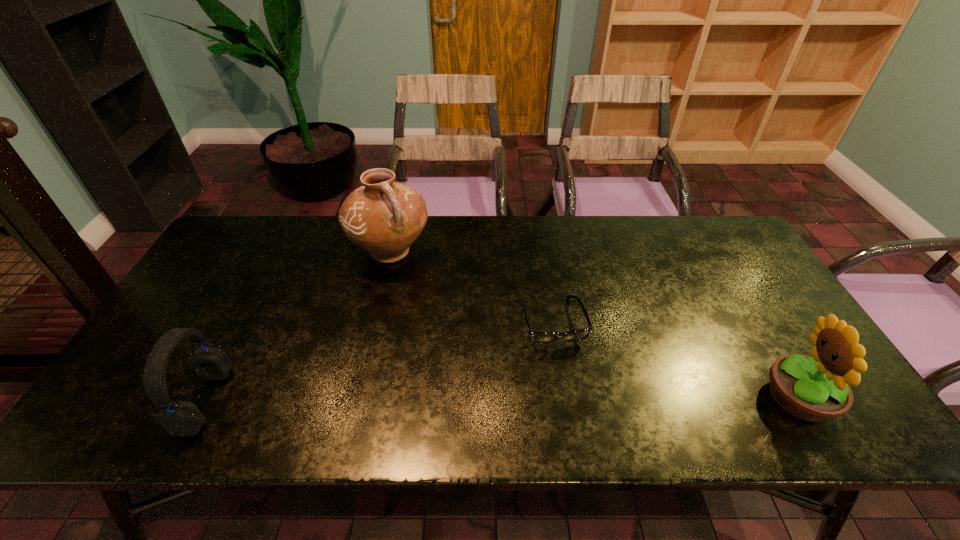
Identify the location of free space on the desktop that is between the leftmost object and the rightmost object and is positioned on the side of the pottery with the handle. This screenshot has height=540, width=960. (473, 399).

The width and height of the screenshot is (960, 540). Identify the location of free spot on the desktop that is between the headset and the rightmost object and is positioned on the lenses of the third object from left to right. (575, 399).